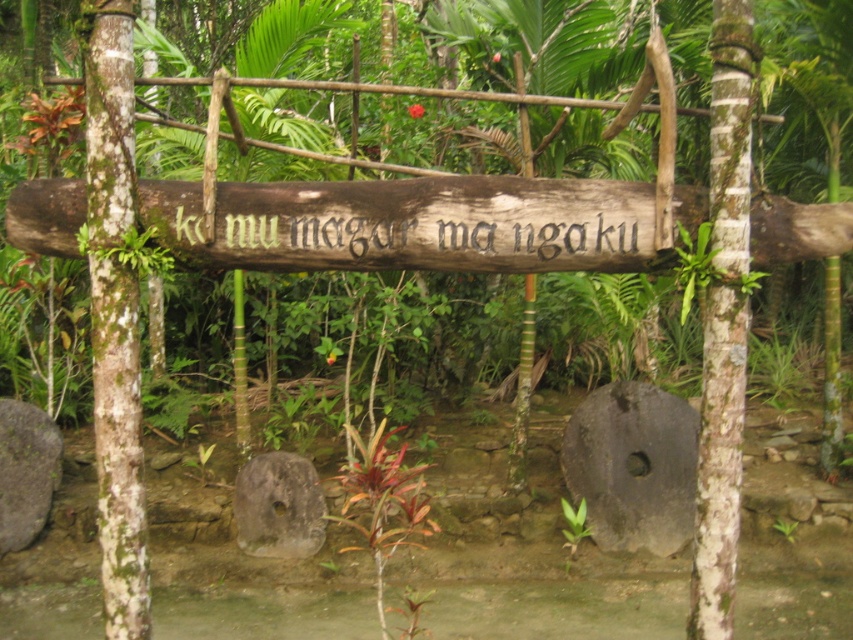
Based on the scene description, where is the brown wooden sign at center located in terms of coordinates?

Answer: The brown wooden sign at center is located at point coordinates of (410, 225).

You are a hiker who needs to place a 1.5 meter long wooden plank between the gray rough stone at center and the gray rough stone at lower left. Can the plank fit between them without bending?

The distance between the gray rough stone at center and the gray rough stone at lower left is 1.21 meters, so the 1.5 meter long wooden plank is longer than the space available. The plank cannot fit between them without bending.

You are a hiker in a jungle and see the rustic wooden signboard supported by four vertical posts with moss. There is a point at coordinates (277, 506). What object is located at that point?

The point at coordinates (277, 506) corresponds to the gray rough stone at center.